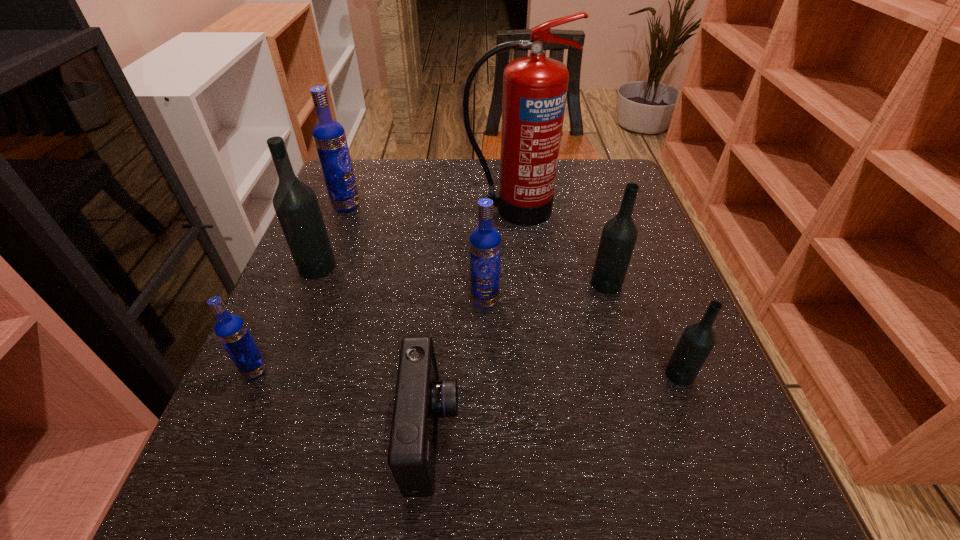
Find the location of a particular element. The image size is (960, 540). empty space between the nearest blue vodka and the shortest object is located at coordinates (343, 403).

This screenshot has width=960, height=540. I want to click on empty space that is in between the second biggest blue vodka and the fifth vodka from left to right, so click(545, 292).

Select which object appears as the third closest to the leftmost black vodka. Please provide its 2D coordinates. Your answer should be formatted as a tuple, i.e. [(x, y)], where the tuple contains the x and y coordinates of a point satisfying the conditions above.

[(535, 87)]

Where is `the sixth closest object to the biggest blue vodka`? The image size is (960, 540). the sixth closest object to the biggest blue vodka is located at coordinates (619, 235).

Locate an element on the screen. the fifth closest vodka relative to the tallest object is located at coordinates (697, 340).

At what (x,y) coordinates should I click in order to perform the action: click on vodka that is the nearest to the camera. Please return your answer as a coordinate pair (x, y). Looking at the image, I should click on (485, 241).

Point out which blue vodka is positioned as the nearest to the farthest vodka. Please provide its 2D coordinates. Your answer should be formatted as a tuple, i.e. [(x, y)], where the tuple contains the x and y coordinates of a point satisfying the conditions above.

[(485, 241)]

I want to click on the second closest blue vodka relative to the red fire extinguisher, so click(329, 137).

Image resolution: width=960 pixels, height=540 pixels. I want to click on black vodka that is the second closest to the second smallest black vodka, so click(296, 205).

Find the location of a particular element. This screenshot has width=960, height=540. black vodka that is the third closest to the farthest vodka is located at coordinates 697,340.